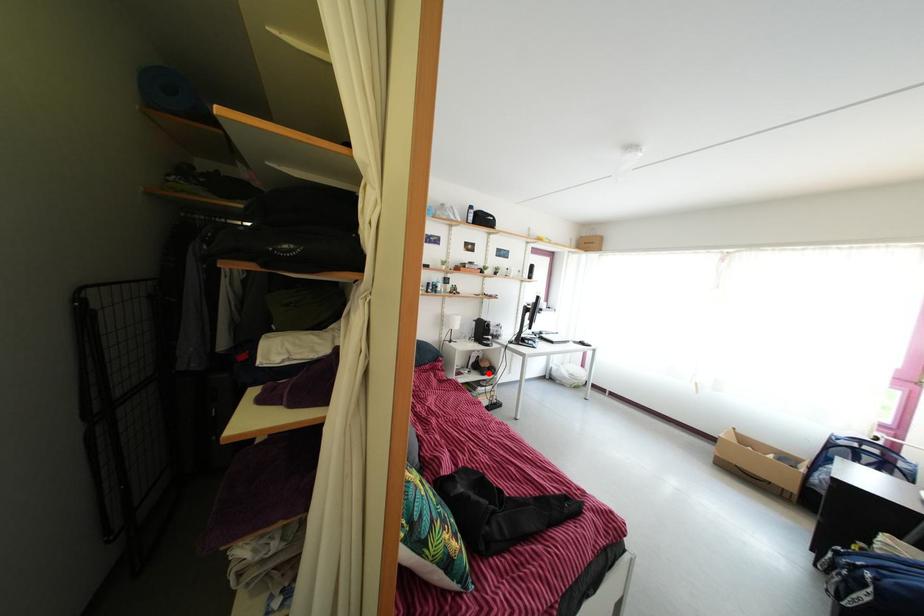
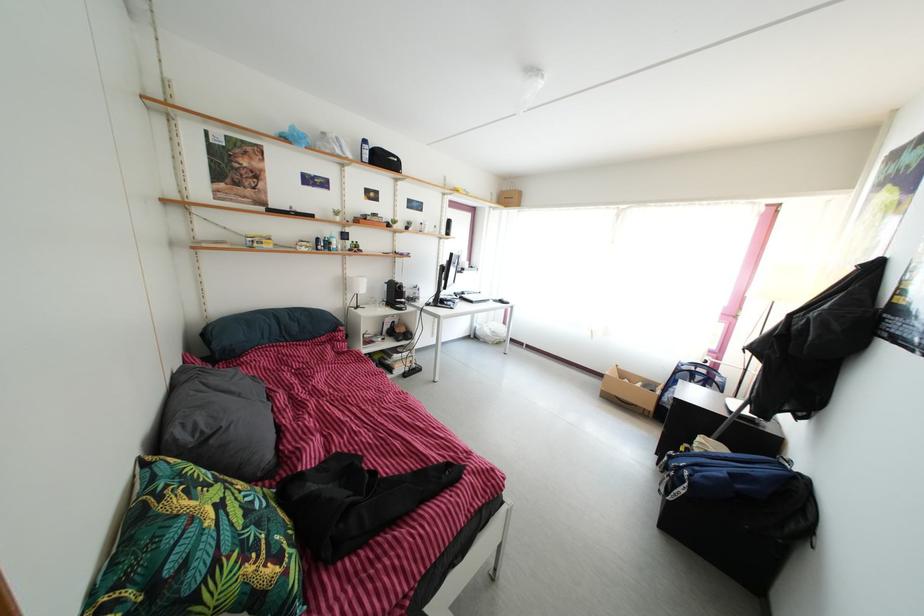
In the second image, find the point that corresponds to the highlighted location in the first image.

(405, 339)